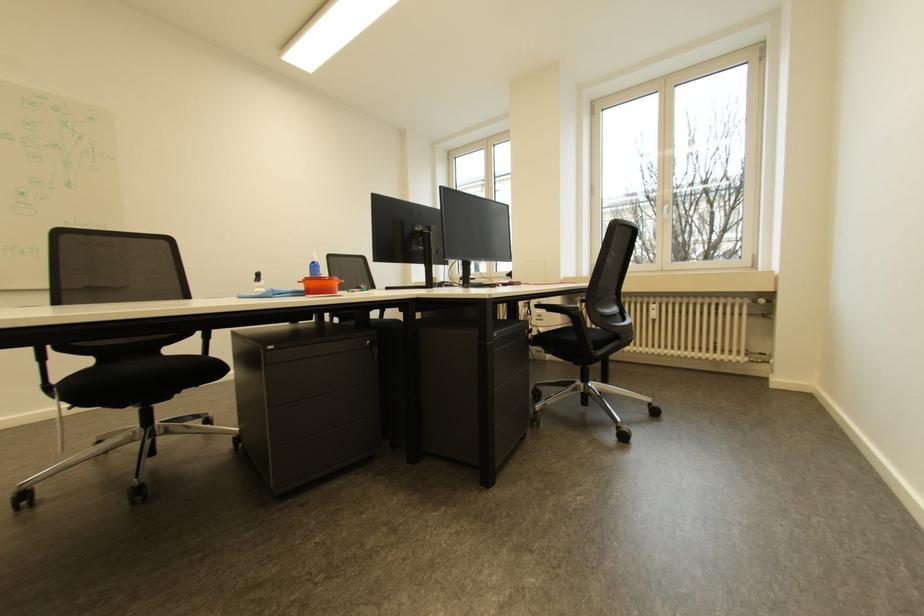
The image size is (924, 616). Find the location of `black chair armrest`. black chair armrest is located at coordinates (564, 302).